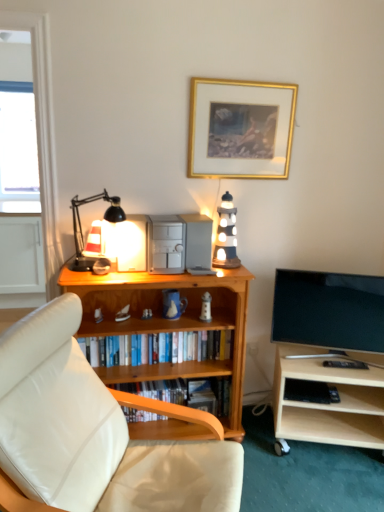
This screenshot has height=512, width=384. Describe the element at coordinates (18, 149) in the screenshot. I see `transparent glass window at upper left` at that location.

The width and height of the screenshot is (384, 512). Find the location of `black plastic book at lower right, acting as the second book starting from the bottom`. black plastic book at lower right, acting as the second book starting from the bottom is located at coordinates (306, 391).

This screenshot has height=512, width=384. Describe the element at coordinates (186, 393) in the screenshot. I see `wooden bookshelf at center, the third book when ordered from top to bottom` at that location.

Identify the location of light wood tv stand at lower right. (329, 404).

Describe the element at coordinates (329, 404) in the screenshot. I see `light wood tv stand at lower right` at that location.

Find the location of a particular element. transparent glass window at upper left is located at coordinates (18, 149).

Would you consider black plastic book at lower right, which is the second book from top to bottom, to be distant from gold metallic picture frame at upper center?

black plastic book at lower right, which is the second book from top to bottom, is positioned a significant distance from gold metallic picture frame at upper center.

Is black plastic book at lower right, acting as the second book starting from the bottom, aimed at gold metallic picture frame at upper center?

No, black plastic book at lower right, acting as the second book starting from the bottom, is not facing towards gold metallic picture frame at upper center.

From the picture: Which object is wider, black plastic book at lower right, acting as the second book starting from the bottom, or gold metallic picture frame at upper center?

With larger width is black plastic book at lower right, acting as the second book starting from the bottom.

Where is `picture frame in front of the black plastic book at lower right, acting as the second book starting from the bottom`? The width and height of the screenshot is (384, 512). picture frame in front of the black plastic book at lower right, acting as the second book starting from the bottom is located at coordinates (240, 129).

From the picture: How much distance is there between black plastic book at lower right, which is the second book from top to bottom, and wooden lighthouse at center?

They are 32.76 inches apart.

Can you tell me how much black plastic book at lower right, which is the second book from top to bottom, and wooden lighthouse at center differ in facing direction?

The angular difference between black plastic book at lower right, which is the second book from top to bottom, and wooden lighthouse at center is 11.8 degrees.

Is black plastic book at lower right, acting as the second book starting from the bottom, taller than wooden lighthouse at center?

Incorrect, the height of black plastic book at lower right, acting as the second book starting from the bottom, is not larger of that of wooden lighthouse at center.

Does black plastic book at lower right, which is the second book from top to bottom, turn towards wooden lighthouse at center?

No, black plastic book at lower right, which is the second book from top to bottom, is not aimed at wooden lighthouse at center.

Considering the relative sizes of transparent glass door at left and transparent glass window at upper left in the image provided, is transparent glass door at left taller than transparent glass window at upper left?

Yes.

From the image's perspective, is transparent glass door at left above or below transparent glass window at upper left?

From the image's perspective, transparent glass door at left appears below transparent glass window at upper left.

Which is in front, point (43, 192) or point (5, 147)?

Positioned in front is point (43, 192).

Is matte black table lamp at left located outside wooden bookshelf at center, the first book from the top?

Yes, matte black table lamp at left is located beyond the bounds of wooden bookshelf at center, the first book from the top.

From the image's perspective, is matte black table lamp at left on wooden bookshelf at center, the 3th book when ordered from bottom to top?

Yes, from the image's perspective, matte black table lamp at left is above wooden bookshelf at center, the 3th book when ordered from bottom to top.

Starting from the matte black table lamp at left, which book is the 1st one behind? Please provide its 2D coordinates.

[(162, 348)]

Visually, is matte black table lamp at left positioned to the left or to the right of wooden bookshelf at center, the 3th book when ordered from bottom to top?

In the image, matte black table lamp at left appears on the left side of wooden bookshelf at center, the 3th book when ordered from bottom to top.

Could you tell me if white leather studio couch at lower left is turned towards gold metallic picture frame at upper center?

No, white leather studio couch at lower left is not facing towards gold metallic picture frame at upper center.

Does point (198, 473) come behind point (269, 155)?

No, (198, 473) is in front of (269, 155).

Consider the image. From the image's perspective, is white leather studio couch at lower left over gold metallic picture frame at upper center?

Incorrect, from the image's perspective, white leather studio couch at lower left is lower than gold metallic picture frame at upper center.

How different are the orientations of white leather studio couch at lower left and gold metallic picture frame at upper center in degrees?

The angular difference between white leather studio couch at lower left and gold metallic picture frame at upper center is 65.5 degrees.

This screenshot has width=384, height=512. Identify the location of picture frame in front of the wooden bookshelf at center, which is the 1th book in bottom-to-top order. (240, 129).

From the image's perspective, does wooden bookshelf at center, the third book when ordered from top to bottom, appear lower than gold metallic picture frame at upper center?

Indeed, from the image's perspective, wooden bookshelf at center, the third book when ordered from top to bottom, is shown beneath gold metallic picture frame at upper center.

Is wooden bookshelf at center, the third book when ordered from top to bottom, beside gold metallic picture frame at upper center?

No, wooden bookshelf at center, the third book when ordered from top to bottom, is not in contact with gold metallic picture frame at upper center.

Is wooden bookshelf at center, the third book when ordered from top to bottom, at the right side of gold metallic picture frame at upper center?

No, wooden bookshelf at center, the third book when ordered from top to bottom, is not to the right of gold metallic picture frame at upper center.

Between transparent glass window at upper left and light wood tv stand at lower right, which one has less height?

With less height is light wood tv stand at lower right.

Between transparent glass window at upper left and light wood tv stand at lower right, which one is positioned behind?

Positioned behind is transparent glass window at upper left.

Find the location of a particular element. This screenshot has height=512, width=384. window screen behind the light wood tv stand at lower right is located at coordinates (18, 149).

From a real-world perspective, is transparent glass window at upper left physically located above or below light wood tv stand at lower right?

transparent glass window at upper left is situated higher than light wood tv stand at lower right in the real world.

Where is `picture frame in front of the black plastic book at lower right, which is the second book from top to bottom`? The image size is (384, 512). picture frame in front of the black plastic book at lower right, which is the second book from top to bottom is located at coordinates (240, 129).

Identify the location of the 2nd book below the wooden lighthouse at center (from the image's perspective). (306, 391).

Looking at the image, which one is located closer to transparent glass window at upper left, matte black table lamp at left or white leather studio couch at lower left?

Based on the image, matte black table lamp at left appears to be nearer to transparent glass window at upper left.

Considering their positions, is transparent glass window at upper left positioned further to transparent glass door at left than matte black table lamp at left?

Among the two, transparent glass window at upper left is located further to transparent glass door at left.

Estimate the real-world distances between objects in this image. Which object is further from light wood tv stand at lower right, wooden lighthouse at center or transparent glass door at left?

The object further to light wood tv stand at lower right is transparent glass door at left.

When comparing their distances from matte black table lamp at left, does transparent glass door at left or wooden lighthouse at center seem closer?

Based on the image, transparent glass door at left appears to be nearer to matte black table lamp at left.

Considering their positions, is white leather studio couch at lower left positioned further to gold metallic picture frame at upper center than wooden bookshelf at center, the third book when ordered from top to bottom?

wooden bookshelf at center, the third book when ordered from top to bottom, is positioned further to the anchor gold metallic picture frame at upper center.

Based on their spatial positions, is black plastic book at lower right, which is the second book from top to bottom, or white leather studio couch at lower left closer to gold metallic picture frame at upper center?

Among the two, white leather studio couch at lower left is located nearer to gold metallic picture frame at upper center.

Which object lies nearer to the anchor point white leather studio couch at lower left, matte black table lamp at left or wooden lighthouse at center?

matte black table lamp at left lies closer to white leather studio couch at lower left than the other object.

Based on their spatial positions, is light wood tv stand at lower right or transparent glass window at upper left further from wooden bookshelf at center, the first book from the top?

transparent glass window at upper left.

Locate an element on the screen. speaker between matte black table lamp at left and gold metallic picture frame at upper center is located at coordinates (226, 234).

Identify the location of glass door between transparent glass window at upper left and light wood tv stand at lower right in the horizontal direction. The width and height of the screenshot is (384, 512). (40, 106).

Where is `speaker situated between wooden bookshelf at center, the first book from the top, and flat screen tv at right from left to right`? This screenshot has width=384, height=512. speaker situated between wooden bookshelf at center, the first book from the top, and flat screen tv at right from left to right is located at coordinates (226, 234).

Find the location of a particular element. This screenshot has height=512, width=384. television located between white leather studio couch at lower left and black plastic book at lower right, which is the second book from top to bottom, in the depth direction is located at coordinates (329, 310).